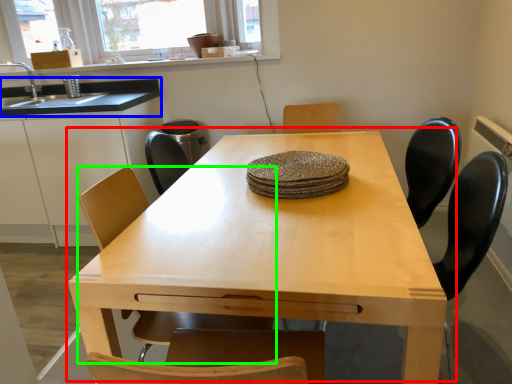
Question: Estimate the real-world distances between objects in this image. Which object is closer to table (highlighted by a red box), countertop (highlighted by a blue box) or chair (highlighted by a green box)?

Choices:
 (A) countertop
 (B) chair

Answer: (B)